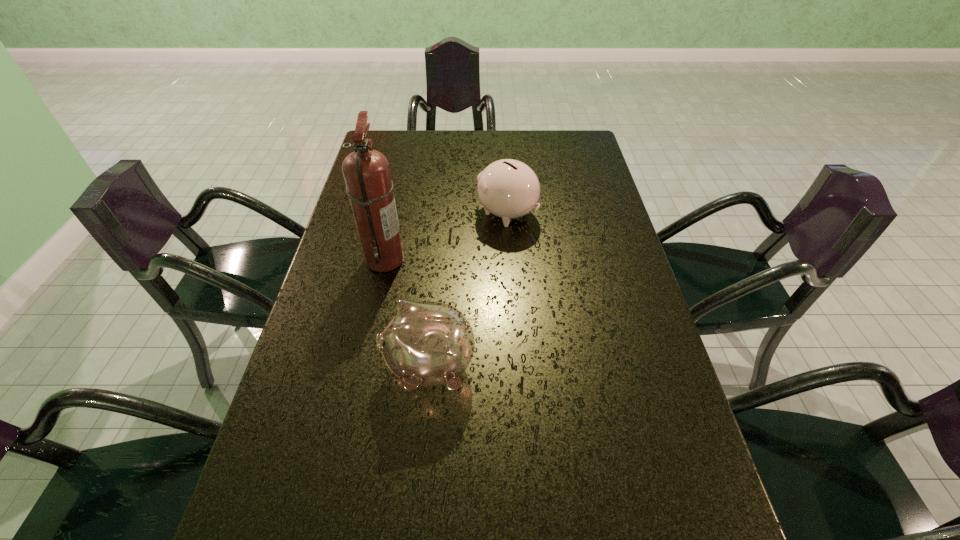
Identify the location of the tallest object. This screenshot has width=960, height=540. (369, 186).

This screenshot has width=960, height=540. In order to click on the second farthest object in this screenshot , I will do `click(369, 186)`.

Identify the location of the left piggy bank. The height and width of the screenshot is (540, 960). (425, 343).

Identify the location of the nearer piggy bank. The width and height of the screenshot is (960, 540). (425, 343).

Find the location of a particular element. the right piggy bank is located at coordinates (507, 188).

What are the coordinates of `the farther piggy bank` in the screenshot? It's located at (507, 188).

Image resolution: width=960 pixels, height=540 pixels. Find the location of `vacant space located on the front-facing side of the fire extinguisher`. vacant space located on the front-facing side of the fire extinguisher is located at coordinates tap(542, 259).

I want to click on free space located 0.100m on the front facing side of the nearer piggy bank, so click(339, 366).

Locate an element on the screen. This screenshot has height=540, width=960. vacant space located 0.150m on the front facing side of the nearer piggy bank is located at coordinates (316, 366).

At what (x,y) coordinates should I click in order to perform the action: click on blank space located 0.060m on the front facing side of the nearer piggy bank. Please return your answer as a coordinate pair (x, y). This screenshot has width=960, height=540. Looking at the image, I should click on (356, 366).